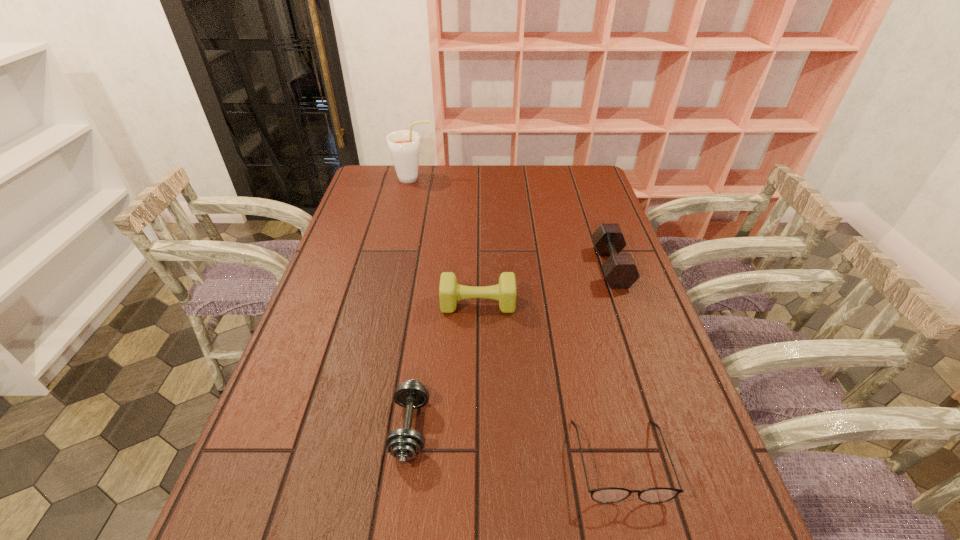
Locate an element on the screen. free space located 0.230m on the front of the second farthest dumbbell is located at coordinates (477, 389).

Where is `vacant space located 0.340m on the right of the nearest dumbbell`? vacant space located 0.340m on the right of the nearest dumbbell is located at coordinates (593, 428).

Image resolution: width=960 pixels, height=540 pixels. I want to click on object positioned at the far edge, so click(404, 145).

Where is `object that is positioned at the left edge`? The image size is (960, 540). object that is positioned at the left edge is located at coordinates (404, 145).

Locate an element on the screen. dumbbell positioned at the right edge is located at coordinates coord(620,270).

Identify the location of spectacles situated at the right edge. Image resolution: width=960 pixels, height=540 pixels. (612, 494).

Find the location of a particular element. This screenshot has height=540, width=960. object present at the far left corner is located at coordinates (404, 145).

Where is `free space at the far edge of the desktop`? free space at the far edge of the desktop is located at coordinates (521, 185).

Locate an element on the screen. vacant space at the left edge is located at coordinates (342, 329).

Image resolution: width=960 pixels, height=540 pixels. In order to click on free space at the right edge of the desktop in this screenshot , I will do `click(655, 398)`.